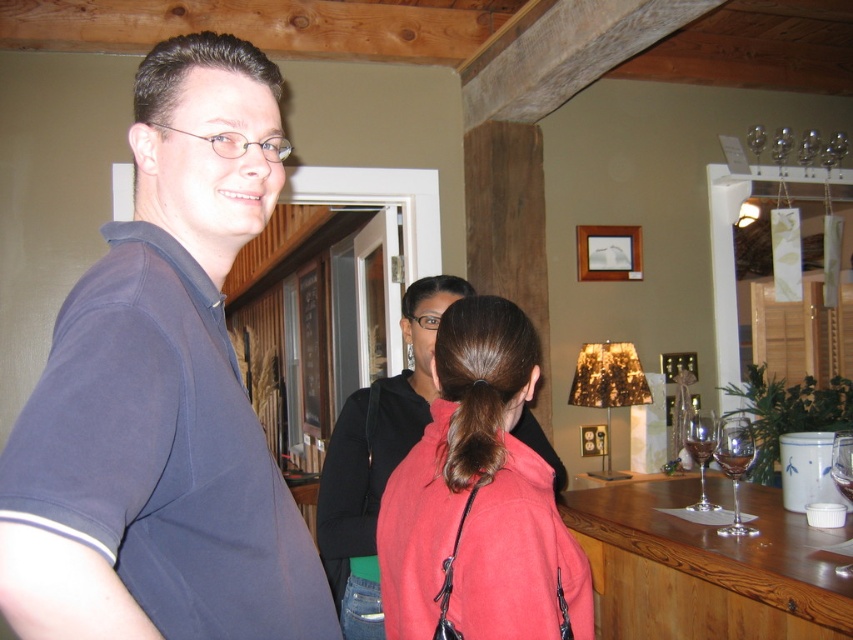
You are standing in the bar scene and want to take a photo of the two points mentioned. Which point, point (39, 420) or point (448, 484), will appear larger in your camera view?

Point (39, 420) is closer to the camera than point (448, 484), so it will appear larger in the camera view.

Consider the image. You are standing in the bar and want to move from point (395, 637) to point (456, 388). Which direction should you move to get closer to the latter?

You should move away from the viewer since point (456, 388) is further away than point (395, 637).